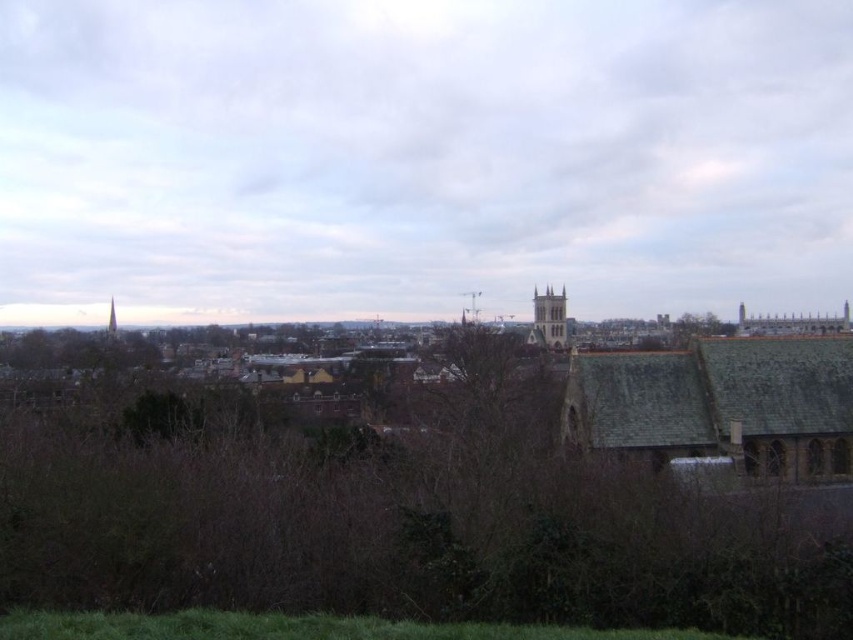
Question: Is light brown stone tower at center below green leafy tree at upper center?

Choices:
 (A) no
 (B) yes

Answer: (A)

Question: Which point is farther to the camera?

Choices:
 (A) brown leafless tree at center
 (B) green leafy tree at upper center
 (C) smooth gray spire at upper center
 (D) light brown stone tower at center

Answer: (C)

Question: Is green leafy tree at upper center bigger than smooth gray spire at upper center?

Choices:
 (A) yes
 (B) no

Answer: (A)

Question: Can you confirm if light brown stone tower at center is positioned to the left of smooth gray spire at upper center?

Choices:
 (A) no
 (B) yes

Answer: (A)

Question: Which point is closer to the camera?

Choices:
 (A) (677, 336)
 (B) (294, 420)
 (C) (113, 304)

Answer: (B)

Question: Which point appears closest to the camera in this image?

Choices:
 (A) (554, 340)
 (B) (114, 326)

Answer: (A)